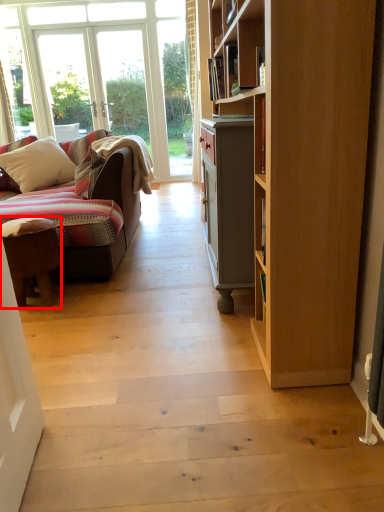
Question: Where is desk (annotated by the red box) located in relation to pillow in the image?

Choices:
 (A) right
 (B) left

Answer: (A)